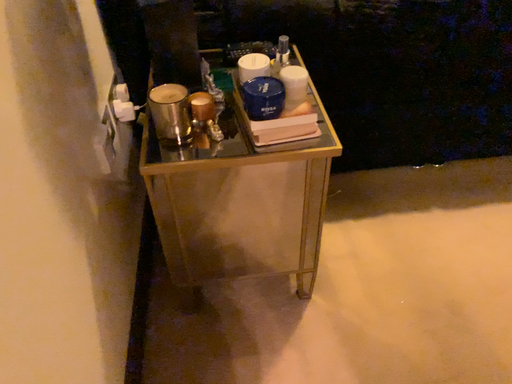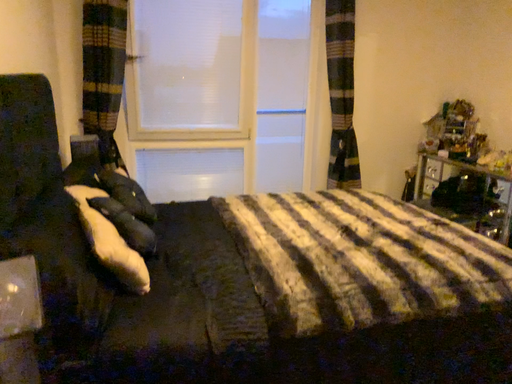
Question: Which way did the camera rotate in the video?

Choices:
 (A) rotated upward
 (B) rotated downward

Answer: (A)